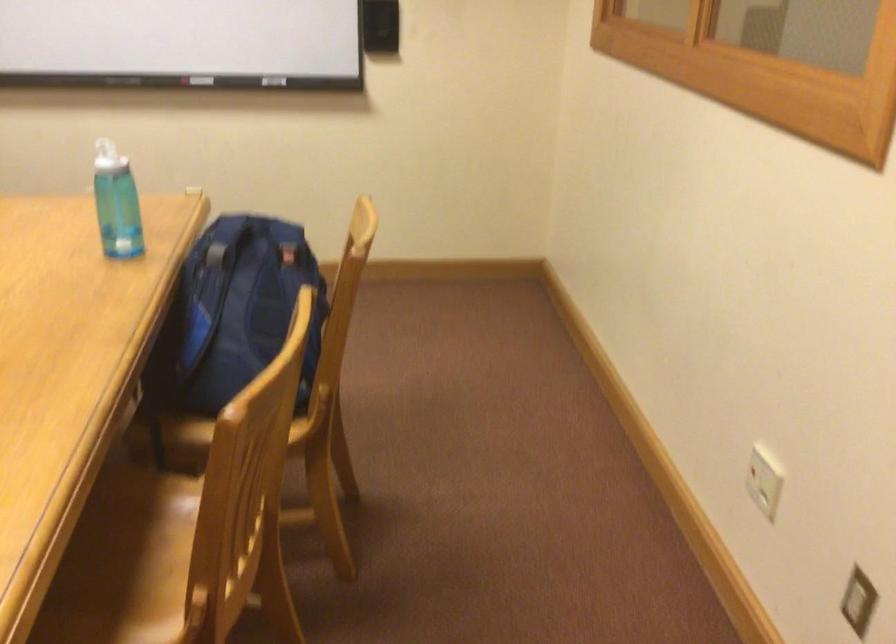
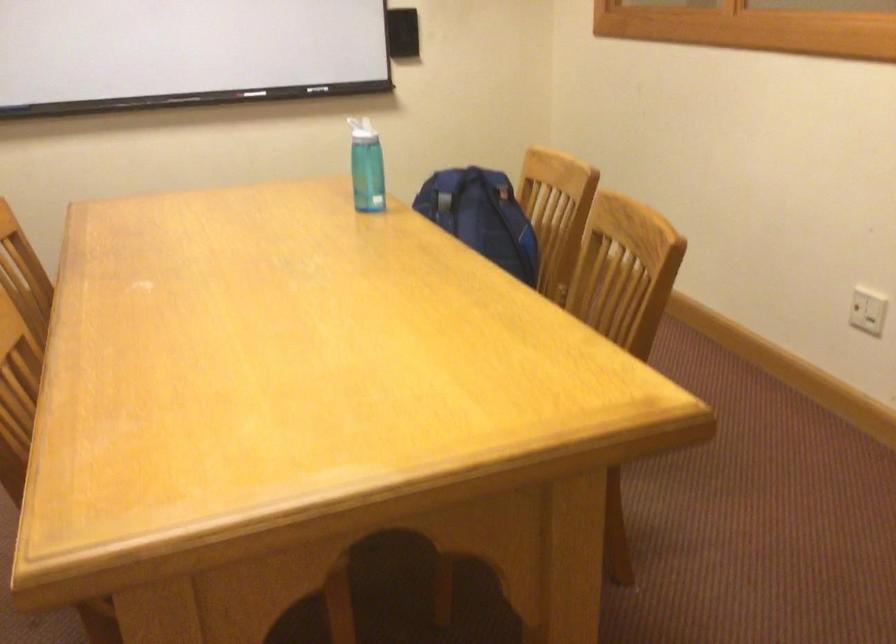
Question: Based on the continuous images, in which direction is the camera rotating? Reply with the corresponding letter.

Choices:
 (A) Left
 (B) Right
 (C) Up
 (D) Down

Answer: (B)